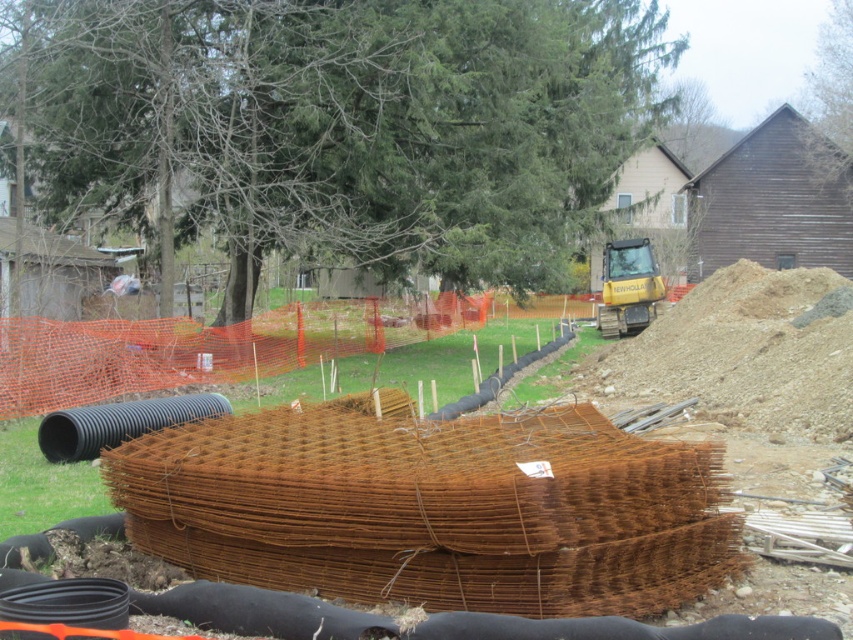
Question: Can you confirm if rusty wire mesh at center is smaller than yellow rubber at center?

Choices:
 (A) no
 (B) yes

Answer: (A)

Question: Among these objects, which one is farthest from the camera?

Choices:
 (A) brown gravel pile at right
 (B) rusty wire mesh at center
 (C) yellow rubber at center

Answer: (C)

Question: Which of the following is the closest to the observer?

Choices:
 (A) brown gravel pile at right
 (B) rusty wire mesh at center
 (C) yellow rubber at center

Answer: (B)

Question: Among these objects, which one is farthest from the camera?

Choices:
 (A) yellow rubber at center
 (B) brown gravel pile at right
 (C) rusty wire mesh at center

Answer: (A)

Question: Is rusty wire mesh at center in front of brown gravel pile at right?

Choices:
 (A) yes
 (B) no

Answer: (A)

Question: In this image, where is rusty wire mesh at center located relative to brown gravel pile at right?

Choices:
 (A) below
 (B) above

Answer: (A)